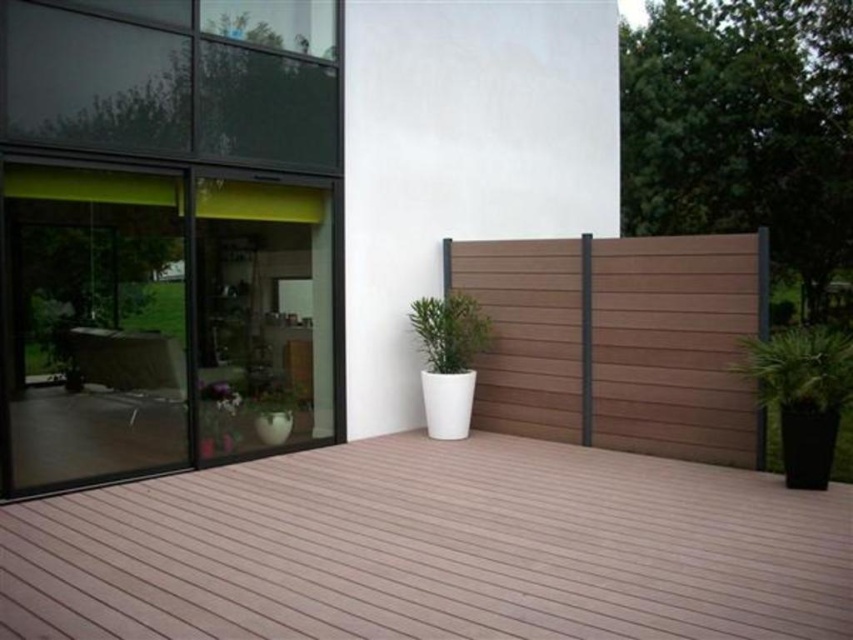
Question: Which of the following is the farthest from the observer?

Choices:
 (A) (294, 406)
 (B) (810, 384)
 (C) (297, 397)

Answer: (C)

Question: Is brown wood deck at center thinner than green matte plant at lower center?

Choices:
 (A) yes
 (B) no

Answer: (B)

Question: Is the position of brown wood fence at center less distant than that of green matte plant at center?

Choices:
 (A) no
 (B) yes

Answer: (B)

Question: Can you confirm if transparent glass screen door at left is thinner than transparent glass screen door at center?

Choices:
 (A) no
 (B) yes

Answer: (A)

Question: Considering the real-world distances, which object is farthest from the transparent glass screen door at left?

Choices:
 (A) brown wood fence at center
 (B) green matte plant at right
 (C) green matte plant at center

Answer: (B)

Question: Which point appears closest to the camera in this image?

Choices:
 (A) (735, 372)
 (B) (90, 268)
 (C) (259, 426)

Answer: (A)